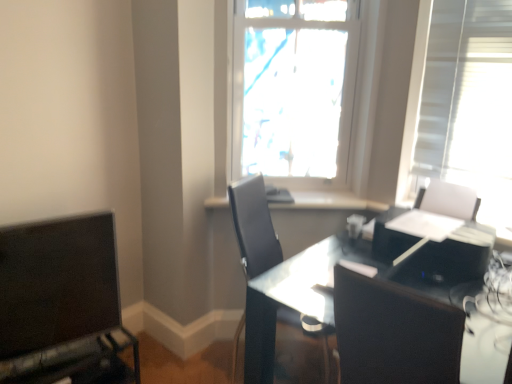
This screenshot has width=512, height=384. What do you see at coordinates (254, 226) in the screenshot? I see `black leather chair at center` at bounding box center [254, 226].

What do you see at coordinates (454, 256) in the screenshot?
I see `black glossy printer at right` at bounding box center [454, 256].

You are a GUI agent. You are given a task and a screenshot of the screen. Output one action in this format:
    pyautogui.click(x=<x>, y=<y>)
    Task: Click on the black leather chair at center
    
    Given the screenshot: What is the action you would take?
    pyautogui.click(x=254, y=226)

In the scene shown: Between transparent glass window at center and white glossy window sill at center, which one has larger width?

white glossy window sill at center.

At what (x,y) coordinates should I click in order to perform the action: click on window that appears in front of the white glossy window sill at center. Please return your answer as a coordinate pair (x, y). This screenshot has width=512, height=384. Looking at the image, I should click on (298, 96).

From a real-world perspective, does transparent glass window at center sit lower than white glossy window sill at center?

No, from a real-world perspective, transparent glass window at center is not under white glossy window sill at center.

Is white glossy window sill at center looking in the opposite direction of black leather chair at center?

No, black leather chair at center is not at the back of white glossy window sill at center.

From the image's perspective, does white glossy window sill at center appear higher than black leather chair at center?

Yes, from the image's perspective, white glossy window sill at center is over black leather chair at center.

From their relative heights in the image, would you say white glossy window sill at center is taller or shorter than black leather chair at center?

Considering their sizes, white glossy window sill at center has less height than black leather chair at center.

Relative to black leather chair at center, is white glossy window sill at center in front or behind?

Clearly, white glossy window sill at center is behind black leather chair at center.

Is matte black monitor at lower left at the back of black glossy printer at right?

No, black glossy printer at right is not facing away from matte black monitor at lower left.

From a real-world perspective, is black glossy printer at right above or below matte black monitor at lower left?

black glossy printer at right is above matte black monitor at lower left.

Which is behind, point (452, 254) or point (2, 300)?

The point (452, 254) is behind.

From the image's perspective, would you say black glossy printer at right is positioned over matte black monitor at lower left?

Indeed, from the image's perspective, black glossy printer at right is shown above matte black monitor at lower left.

Is matte black monitor at lower left surrounding white glossy window sill at center?

Definitely not — white glossy window sill at center is not inside matte black monitor at lower left.

Are matte black monitor at lower left and white glossy window sill at center beside each other?

No, matte black monitor at lower left is not in contact with white glossy window sill at center.

Based on the photo, is matte black monitor at lower left shorter than white glossy window sill at center?

Incorrect, the height of matte black monitor at lower left does not fall short of that of white glossy window sill at center.

Does matte black monitor at lower left turn towards white glossy window sill at center?

No.

In terms of height, does transparent glass table at center look taller or shorter compared to white glossy window sill at center?

Clearly, transparent glass table at center is taller compared to white glossy window sill at center.

Find the location of `window sill that appears above the transparent glass table at center (from a real-world perspective)`. window sill that appears above the transparent glass table at center (from a real-world perspective) is located at coordinates (330, 201).

From a real-world perspective, is transparent glass table at center beneath white glossy window sill at center?

Yes.

From a real-world perspective, is matte black monitor at lower left on top of transparent glass table at center?

Yes, from a real-world perspective, matte black monitor at lower left is over transparent glass table at center

How many degrees apart are the facing directions of matte black monitor at lower left and transparent glass table at center?

The angle between the facing direction of matte black monitor at lower left and the facing direction of transparent glass table at center is 74.6 degrees.

Is matte black monitor at lower left far away from transparent glass table at center?

That's not correct — matte black monitor at lower left is a little close to transparent glass table at center.

Which of these two, matte black monitor at lower left or transparent glass table at center, is smaller?

With smaller size is matte black monitor at lower left.

Is black glossy printer at right spatially inside transparent glass table at center, or outside of it?

black glossy printer at right cannot be found inside transparent glass table at center.

Who is shorter, black glossy printer at right or transparent glass table at center?

black glossy printer at right.

Between point (376, 243) and point (321, 256), which one is positioned in front?

Positioned in front is point (321, 256).

Looking at the image, does black glossy printer at right seem bigger or smaller compared to transparent glass table at center?

Considering their sizes, black glossy printer at right takes up less space than transparent glass table at center.

I want to click on window lying on the right of white glossy window sill at center, so 298,96.

The image size is (512, 384). I want to click on window sill located on the left of black leather chair at center, so pyautogui.click(x=330, y=201).

Looking at the image, which one is located further to matte black monitor at lower left, white glossy window sill at center or black glossy printer at right?

Based on the image, black glossy printer at right appears to be further to matte black monitor at lower left.

Considering their positions, is white glossy window sill at center positioned further to transparent glass table at center than transparent glass window at center?

transparent glass window at center lies further to transparent glass table at center than the other object.

From the image, which object appears to be nearer to transparent glass window at center, black leather chair at center or black glossy printer at right?

black leather chair at center.

Considering their positions, is black glossy printer at right positioned closer to matte black monitor at lower left than transparent glass window at center?

transparent glass window at center.

Considering their positions, is transparent glass table at center positioned further to transparent glass window at center than black leather chair at center?

transparent glass table at center is further to transparent glass window at center.

Based on their spatial positions, is black glossy printer at right or matte black monitor at lower left closer to transparent glass table at center?

black glossy printer at right is positioned closer to the anchor transparent glass table at center.

Which object lies further to the anchor point transparent glass table at center, white glossy window sill at center or black glossy printer at right?

The object further to transparent glass table at center is white glossy window sill at center.

Based on their spatial positions, is matte black monitor at lower left or white glossy window sill at center closer to transparent glass window at center?

white glossy window sill at center lies closer to transparent glass window at center than the other object.

This screenshot has width=512, height=384. In order to click on computer positioned between transparent glass table at center and white glossy window sill at center from near to far in this screenshot , I will do `click(454, 256)`.

Where is `computer between transparent glass window at center and black leather chair at center in the up-down direction`? computer between transparent glass window at center and black leather chair at center in the up-down direction is located at coordinates (454, 256).

This screenshot has height=384, width=512. I want to click on chair between matte black monitor at lower left and transparent glass table at center, so click(254, 226).

Image resolution: width=512 pixels, height=384 pixels. I want to click on window situated between matte black monitor at lower left and transparent glass table at center from left to right, so click(x=298, y=96).